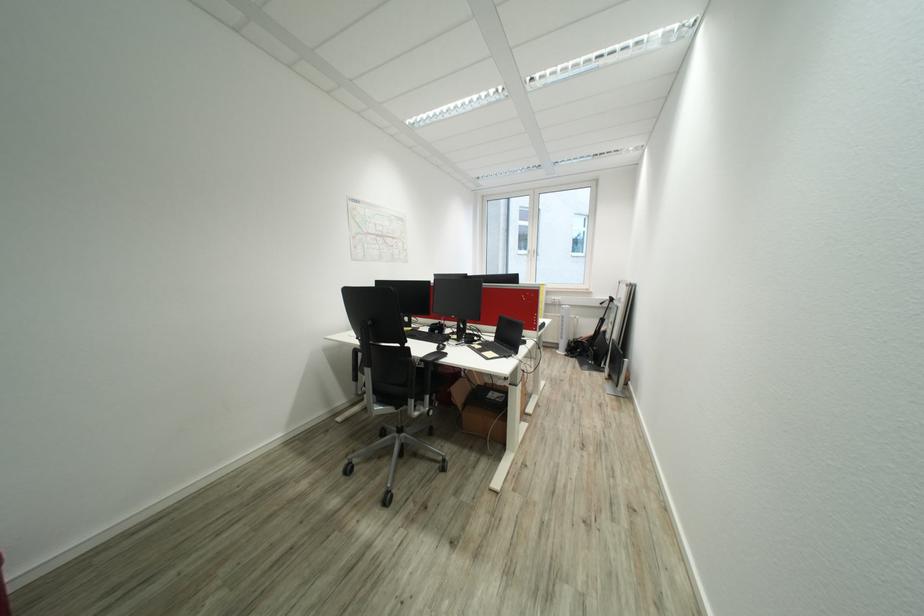
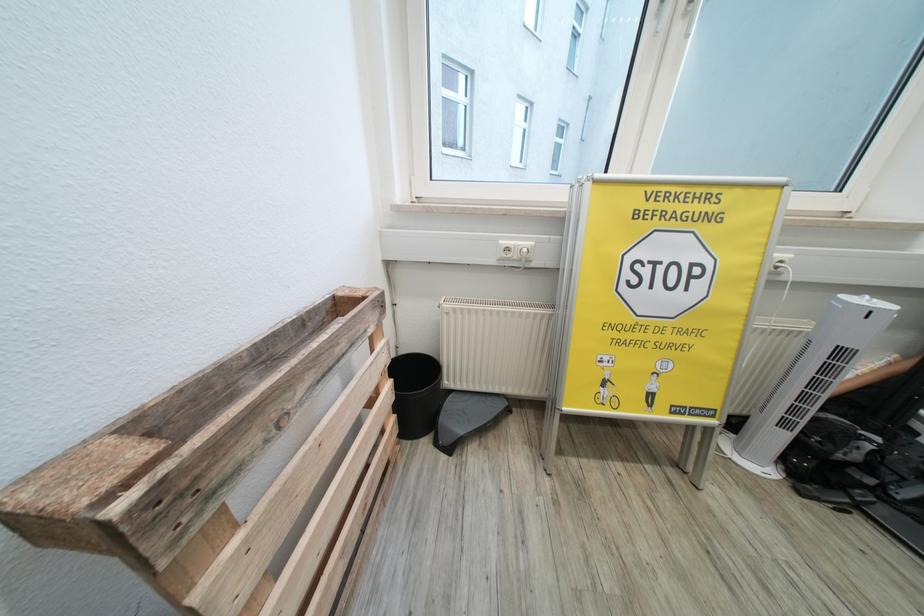
Question: What movement of the cameraman would produce the second image?

Choices:
 (A) Left
 (B) Right
 (C) Forward
 (D) Backward

Answer: (C)